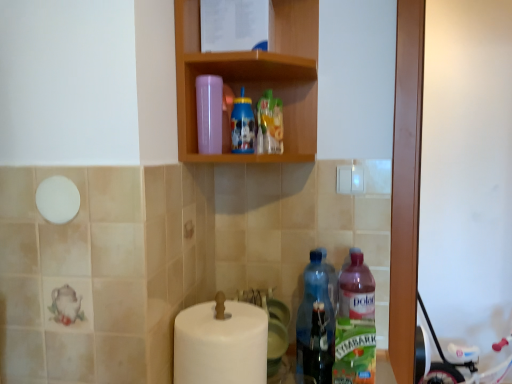
Question: Is white plastic baby carriage at lower right behind polar translucent bottle at lower right, arranged as the fourth bottle when viewed from the left?

Choices:
 (A) no
 (B) yes

Answer: (B)

Question: Does white plastic baby carriage at lower right have a lesser height compared to polar translucent bottle at lower right, arranged as the fourth bottle when viewed from the left?

Choices:
 (A) no
 (B) yes

Answer: (A)

Question: From a real-world perspective, does white plastic baby carriage at lower right sit lower than polar translucent bottle at lower right, which is counted as the 1th bottle, starting from the right?

Choices:
 (A) yes
 (B) no

Answer: (A)

Question: Is white plastic baby carriage at lower right wider than polar translucent bottle at lower right, arranged as the fourth bottle when viewed from the left?

Choices:
 (A) yes
 (B) no

Answer: (A)

Question: Is white plastic baby carriage at lower right positioned before polar translucent bottle at lower right, which is counted as the 1th bottle, starting from the right?

Choices:
 (A) no
 (B) yes

Answer: (A)

Question: Is white plastic baby carriage at lower right beside polar translucent bottle at lower right, arranged as the fourth bottle when viewed from the left?

Choices:
 (A) yes
 (B) no

Answer: (B)

Question: From a real-world perspective, is blue plastic bottle at upper center, which appears as the 3th bottle when viewed from the right, beneath white matte toilet paper at lower center?

Choices:
 (A) yes
 (B) no

Answer: (B)

Question: Can you confirm if blue plastic bottle at upper center, which appears as the 3th bottle when viewed from the right, is taller than white matte toilet paper at lower center?

Choices:
 (A) no
 (B) yes

Answer: (A)

Question: Does blue plastic bottle at upper center, marked as the 2th bottle in a left-to-right arrangement, have a greater width compared to white matte toilet paper at lower center?

Choices:
 (A) no
 (B) yes

Answer: (A)

Question: Is blue plastic bottle at upper center, which appears as the 3th bottle when viewed from the right, turned away from white matte toilet paper at lower center?

Choices:
 (A) no
 (B) yes

Answer: (A)

Question: Is blue plastic bottle at upper center, marked as the 2th bottle in a left-to-right arrangement, not near white matte toilet paper at lower center?

Choices:
 (A) no
 (B) yes

Answer: (A)

Question: From the image's perspective, is blue plastic bottle at upper center, which appears as the 3th bottle when viewed from the right, on top of white matte toilet paper at lower center?

Choices:
 (A) yes
 (B) no

Answer: (A)

Question: Is white plastic baby carriage at lower right far away from white matte toilet paper at lower center?

Choices:
 (A) yes
 (B) no

Answer: (A)